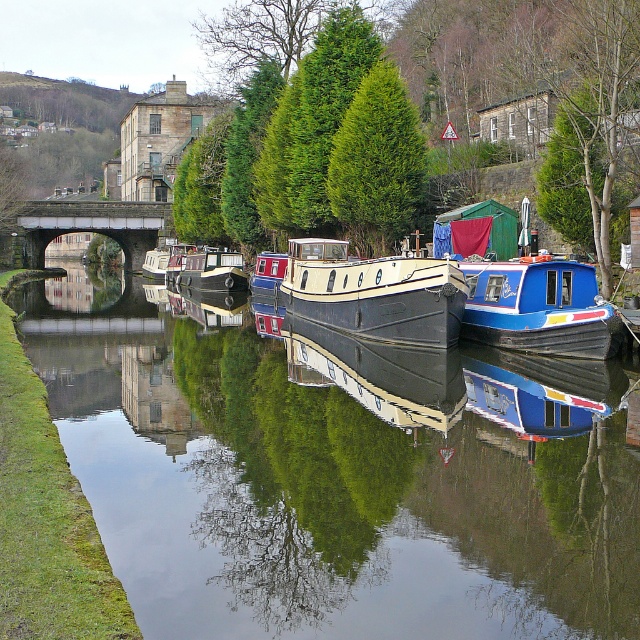
Question: Which is nearer to the stone arch bridge at center?

Choices:
 (A) white glossy canal boat at center
 (B) blue glossy barge at center

Answer: (A)

Question: Observing the image, what is the correct spatial positioning of stone arch bridge at center in reference to white glossy canal boat at center?

Choices:
 (A) above
 (B) below

Answer: (A)

Question: From the image, what is the correct spatial relationship of smooth water at center in relation to blue glossy barge at center?

Choices:
 (A) right
 (B) left

Answer: (A)

Question: Estimate the real-world distances between objects in this image. Which object is farther from the smooth water at center?

Choices:
 (A) blue glossy barge at center
 (B) matte black barge at center

Answer: (A)

Question: Does smooth water at center have a lesser width compared to stone arch bridge at center?

Choices:
 (A) yes
 (B) no

Answer: (B)

Question: Which point appears closest to the camera in this image?

Choices:
 (A) (262, 257)
 (B) (305, 628)

Answer: (B)